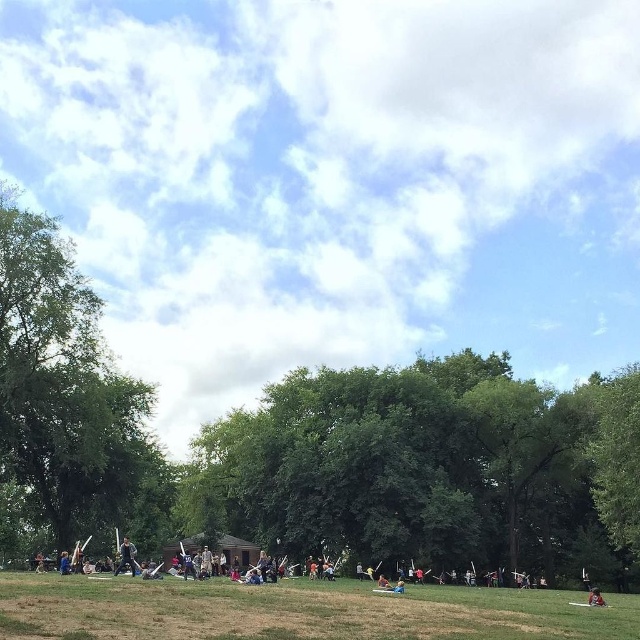
Is dark gray fabric person at center to the right of red fabric person at lower right from the viewer's perspective?

In fact, dark gray fabric person at center is to the left of red fabric person at lower right.

Who is taller, dark gray fabric person at center or red fabric person at lower right?

red fabric person at lower right

What do you see at coordinates (125, 557) in the screenshot? Image resolution: width=640 pixels, height=640 pixels. I see `dark gray fabric person at center` at bounding box center [125, 557].

The width and height of the screenshot is (640, 640). I want to click on dark gray fabric person at center, so click(125, 557).

Can you confirm if green leafy tree at center is positioned below green leafy tree at left?

Correct, green leafy tree at center is located below green leafy tree at left.

Between point (499, 448) and point (67, 545), which one is positioned in front?

Point (67, 545) is more forward.

Which is in front, point (586, 452) or point (0, 497)?

Point (0, 497)

This screenshot has width=640, height=640. In order to click on green leafy tree at center in this screenshot , I will do `click(429, 468)`.

Between green grassy field at center and red fabric person at lower right, which one is positioned lower?

red fabric person at lower right

Does green grassy field at center appear on the left side of red fabric person at lower right?

Indeed, green grassy field at center is positioned on the left side of red fabric person at lower right.

Does point (384, 614) lie in front of point (592, 602)?

Yes, point (384, 614) is in front of point (592, 602).

This screenshot has width=640, height=640. Identify the location of green grassy field at center. (298, 611).